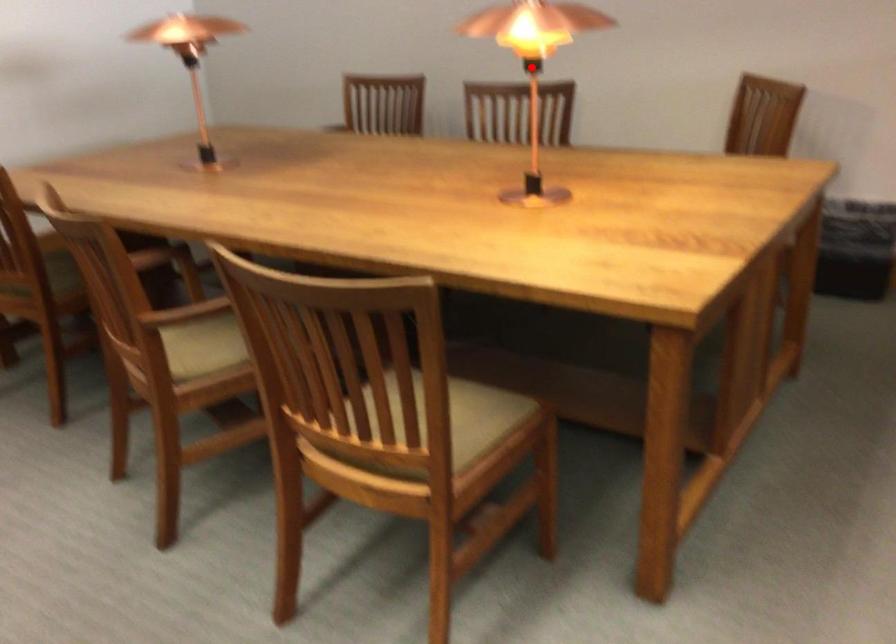
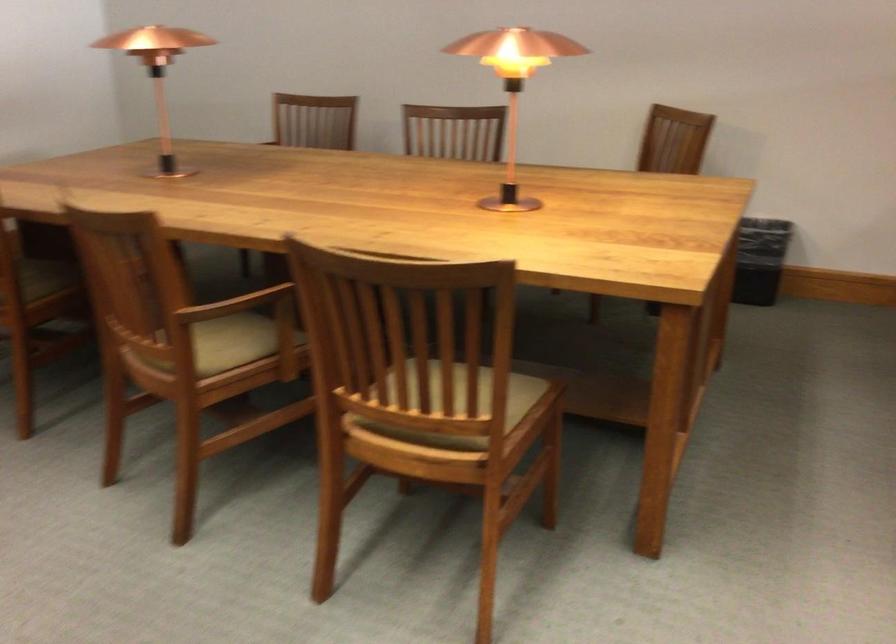
Find the pixel in the second image that matches the highlighted location in the first image.

(513, 88)